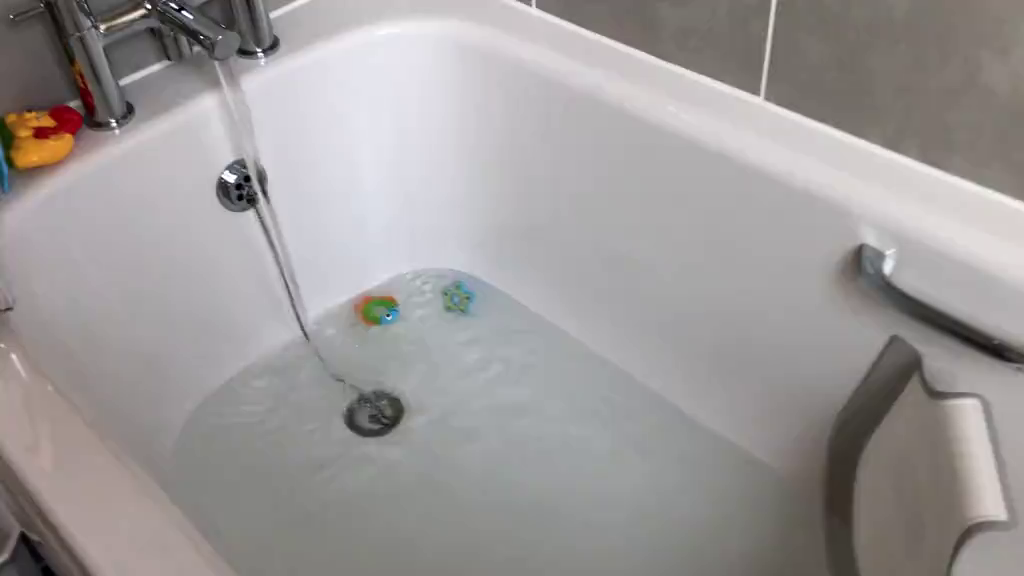
This screenshot has height=576, width=1024. I want to click on cord for drain cork, so click(x=270, y=248).